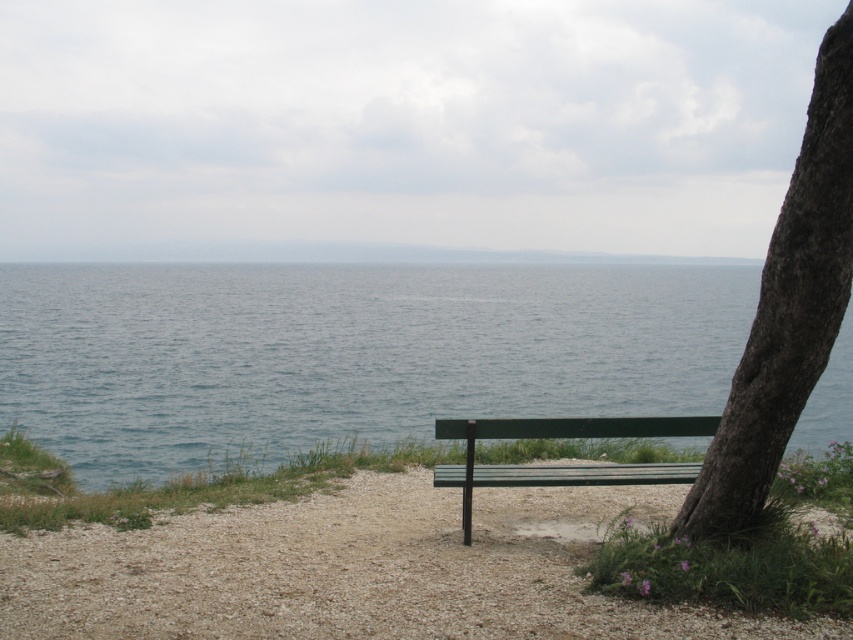
Consider the image. You are a painter setting up your easel to capture the coastal scene. You want to ensure your painting accurately represents the relative sizes of the blue water at center and the green wooden bench at center. Which object should you depict as wider in your artwork?

The blue water at center should be depicted as wider since its width is larger than that of the green wooden bench at center.

You are a painter setting up your easel to capture the coastal scene. You want to ensure the dark brown textured bark at right and the green wooden bench at center are both visible in your painting. Based on their positions, which object will appear closer to you in the painting?

The dark brown textured bark at right appears closer because it is positioned in front of the green wooden bench at center in the scene.